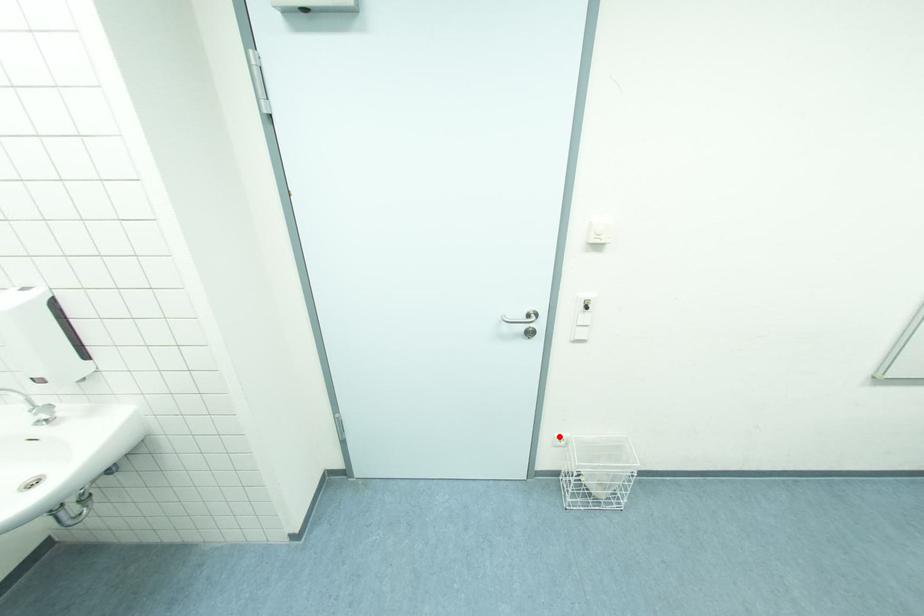
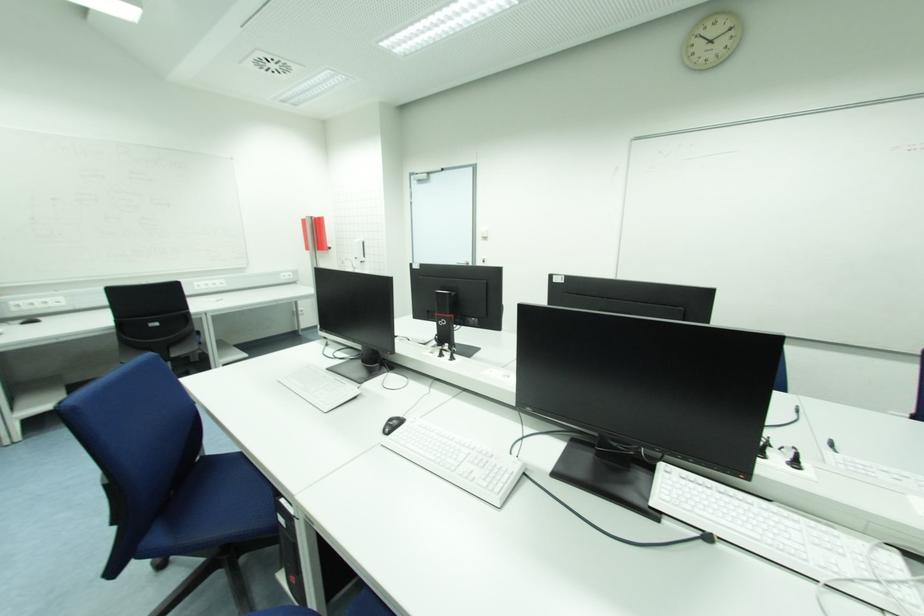
Question: I am providing you with two images of the same scene from different viewpoints. A red point is marked on the first image. Can you still see the location of the red point in image 2?

Choices:
 (A) Yes
 (B) No

Answer: (B)